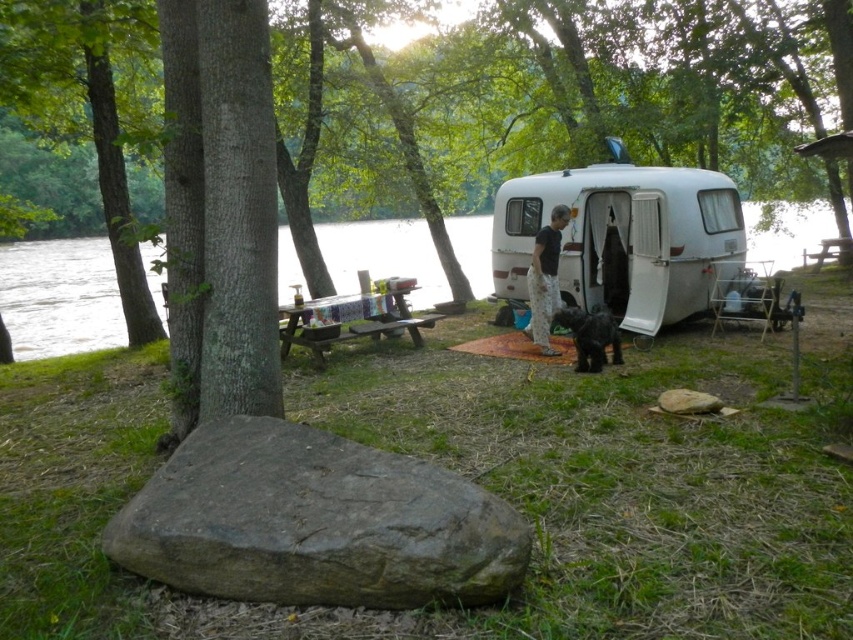
Between brown textured tree trunk at center and black fuzzy dog at center, which one appears on the left side from the viewer's perspective?

brown textured tree trunk at center

Describe the element at coordinates (622, 92) in the screenshot. I see `brown textured tree trunk at center` at that location.

Is point (395, 177) positioned in front of point (584, 310)?

No, it is behind (584, 310).

Locate an element on the screen. The width and height of the screenshot is (853, 640). brown textured tree trunk at center is located at coordinates (622, 92).

Does point (399, 212) come farther from viewer compared to point (538, 230)?

Yes, it is.

Who is lower down, brown textured tree trunk at center or black cotton pants at center?

black cotton pants at center

Which is in front, point (770, 145) or point (538, 289)?

Point (538, 289)

The width and height of the screenshot is (853, 640). In order to click on brown textured tree trunk at center in this screenshot , I will do `click(622, 92)`.

Is gray rock at lower left to the left of white matte trailer at center from the viewer's perspective?

Yes, gray rock at lower left is to the left of white matte trailer at center.

Between point (149, 524) and point (595, 196), which one is positioned in front?

Point (149, 524)

Identify the location of gray rock at lower left. The width and height of the screenshot is (853, 640). (315, 522).